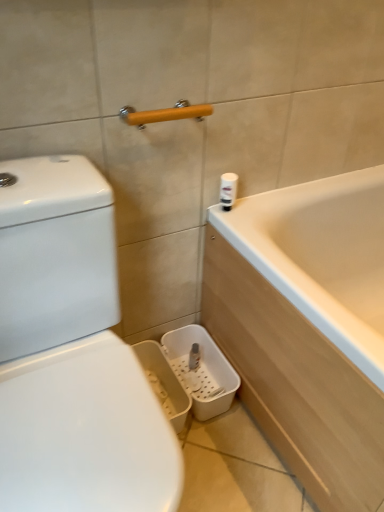
Question: From the image's perspective, is white plastic canister at upper right over yellow matte towel bar at upper center?

Choices:
 (A) no
 (B) yes

Answer: (A)

Question: Is white plastic canister at upper right smaller than yellow matte towel bar at upper center?

Choices:
 (A) yes
 (B) no

Answer: (A)

Question: Is white plastic canister at upper right positioned beyond the bounds of yellow matte towel bar at upper center?

Choices:
 (A) no
 (B) yes

Answer: (B)

Question: Does white plastic canister at upper right lie in front of yellow matte towel bar at upper center?

Choices:
 (A) yes
 (B) no

Answer: (B)

Question: Is white plastic canister at upper right further to camera compared to yellow matte towel bar at upper center?

Choices:
 (A) yes
 (B) no

Answer: (A)

Question: Would you say white plastic canister at upper right contains yellow matte towel bar at upper center?

Choices:
 (A) yes
 (B) no

Answer: (B)

Question: Does yellow matte towel bar at upper center have a greater height compared to white plastic canister at upper right?

Choices:
 (A) yes
 (B) no

Answer: (B)

Question: Is yellow matte towel bar at upper center at the right side of white plastic canister at upper right?

Choices:
 (A) no
 (B) yes

Answer: (A)

Question: Considering the relative positions of yellow matte towel bar at upper center and white plastic canister at upper right in the image provided, is yellow matte towel bar at upper center to the left of white plastic canister at upper right from the viewer's perspective?

Choices:
 (A) no
 (B) yes

Answer: (B)

Question: Does yellow matte towel bar at upper center have a lesser height compared to white plastic canister at upper right?

Choices:
 (A) yes
 (B) no

Answer: (A)

Question: Is yellow matte towel bar at upper center facing towards white plastic canister at upper right?

Choices:
 (A) yes
 (B) no

Answer: (B)

Question: From a real-world perspective, does yellow matte towel bar at upper center stand above white plastic canister at upper right?

Choices:
 (A) no
 (B) yes

Answer: (B)

Question: Considering the positions of point (236, 178) and point (157, 118), is point (236, 178) closer or farther from the camera than point (157, 118)?

Choices:
 (A) closer
 (B) farther

Answer: (B)